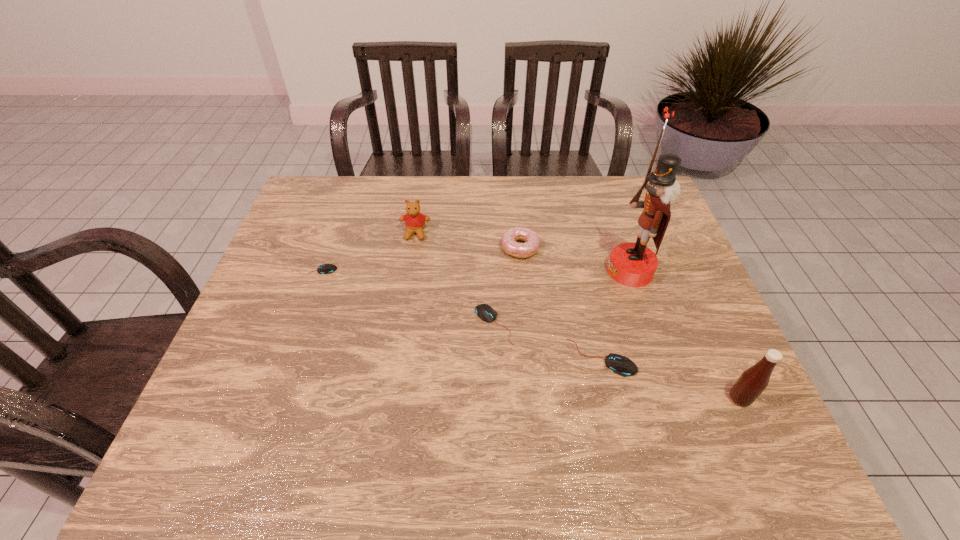
The image size is (960, 540). What are the coordinates of `the farthest mouse` in the screenshot? It's located at (324, 268).

The image size is (960, 540). In order to click on the shortest object in this screenshot , I will do `click(324, 268)`.

The width and height of the screenshot is (960, 540). I want to click on the sixth tallest object, so click(484, 311).

Where is `the second mouse from right to left`? This screenshot has width=960, height=540. the second mouse from right to left is located at coordinates (484, 311).

Where is `the rightmost mouse`? the rightmost mouse is located at coordinates (621, 365).

This screenshot has height=540, width=960. I want to click on the tallest object, so click(x=631, y=264).

Locate an element on the screen. The image size is (960, 540). doughnut is located at coordinates (519, 250).

Where is `the third tallest object`? The width and height of the screenshot is (960, 540). the third tallest object is located at coordinates (414, 220).

Where is `the second object from left to right`? The width and height of the screenshot is (960, 540). the second object from left to right is located at coordinates (414, 220).

Where is `the rightmost object`? This screenshot has width=960, height=540. the rightmost object is located at coordinates (753, 381).